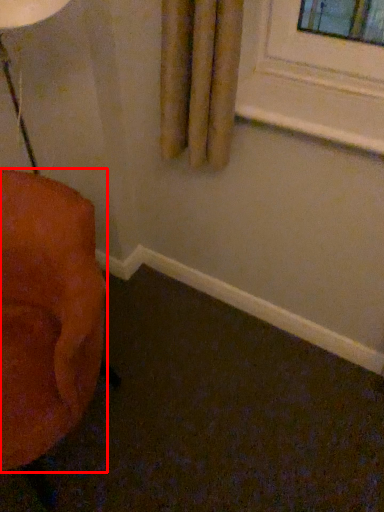
Question: Considering the relative positions of furniture (annotated by the red box) and window sill in the image provided, where is furniture (annotated by the red box) located with respect to the staircase?

Choices:
 (A) left
 (B) right

Answer: (A)